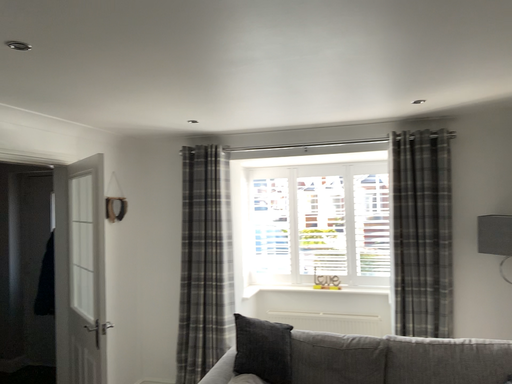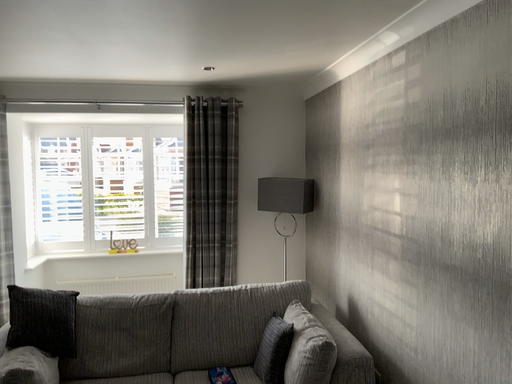
Question: How did the camera likely rotate when shooting the video?

Choices:
 (A) rotated left
 (B) rotated right

Answer: (B)